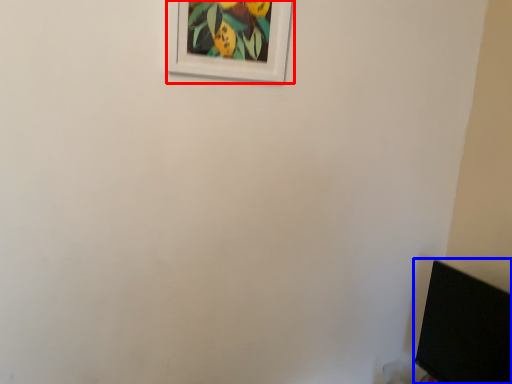
Question: Which object is further to the camera taking this photo, picture frame (highlighted by a red box) or computer monitor (highlighted by a blue box)?

Choices:
 (A) picture frame
 (B) computer monitor

Answer: (A)